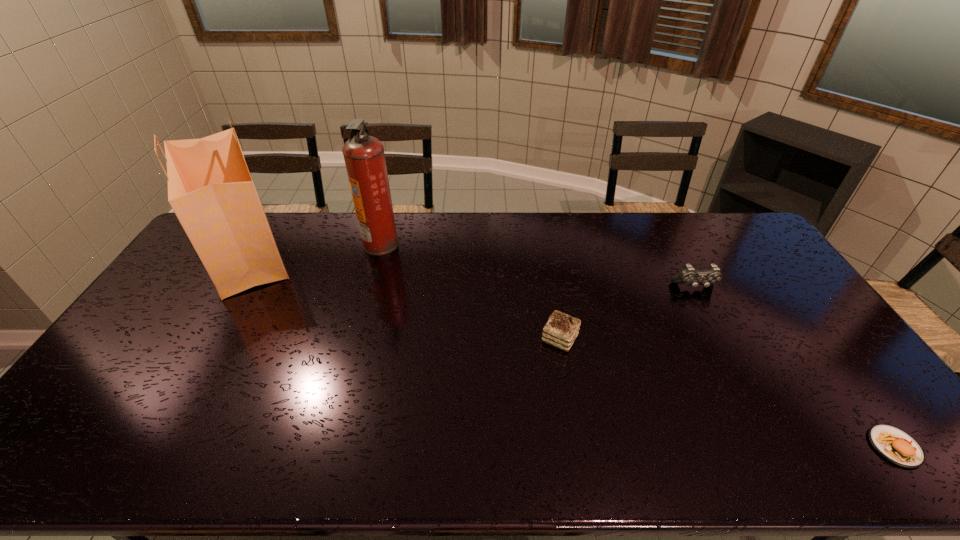
Find the location of a particular element. The width and height of the screenshot is (960, 540). the second object from left to right is located at coordinates (364, 156).

Locate an element on the screen. the leftmost object is located at coordinates (210, 189).

The height and width of the screenshot is (540, 960). In order to click on control in this screenshot , I will do tap(688, 274).

Locate an element on the screen. The image size is (960, 540). the third shortest object is located at coordinates (688, 274).

This screenshot has width=960, height=540. I want to click on the fourth tallest object, so click(561, 330).

Locate an element on the screen. Image resolution: width=960 pixels, height=540 pixels. the second nearest object is located at coordinates (561, 330).

This screenshot has width=960, height=540. I want to click on the shortest object, so click(898, 447).

I want to click on patty, so click(x=898, y=447).

Where is `vacant space located 0.110m at the nozzle of the fire extinguisher`? vacant space located 0.110m at the nozzle of the fire extinguisher is located at coordinates (428, 244).

Identify the location of free space located 0.250m on the side of the grocery bag with the superhero design. Image resolution: width=960 pixels, height=540 pixels. (372, 255).